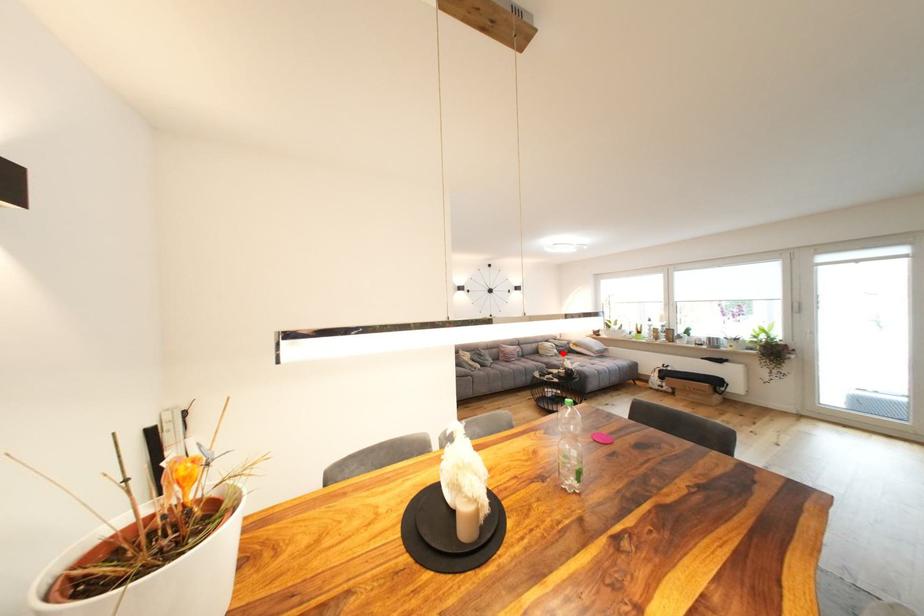
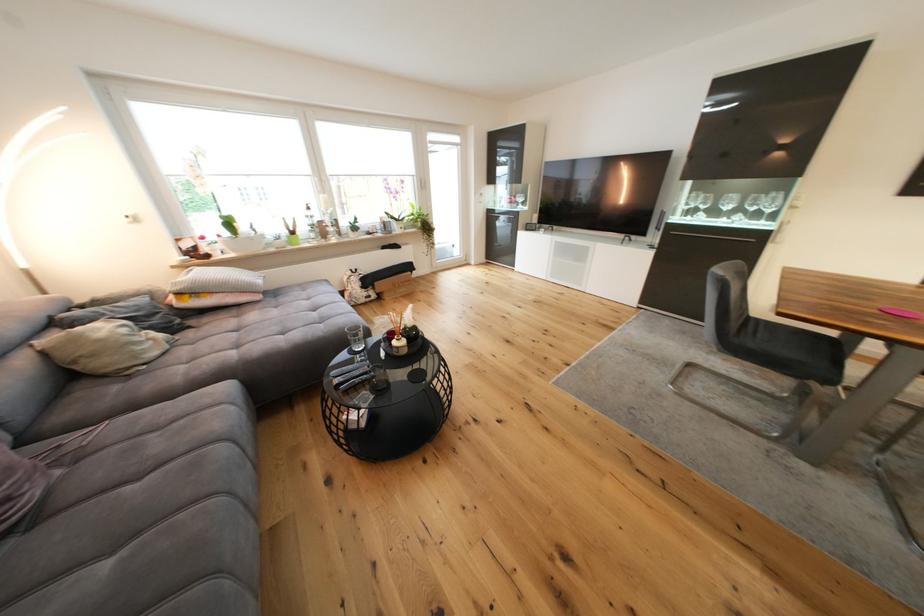
Question: I am providing you with two images of the same scene from different viewpoints. Image1 has a red point marked. In image2, the corresponding 3D location appears at what relative position? Reply with the corresponding letter.

Choices:
 (A) Closer
 (B) Farther

Answer: (A)